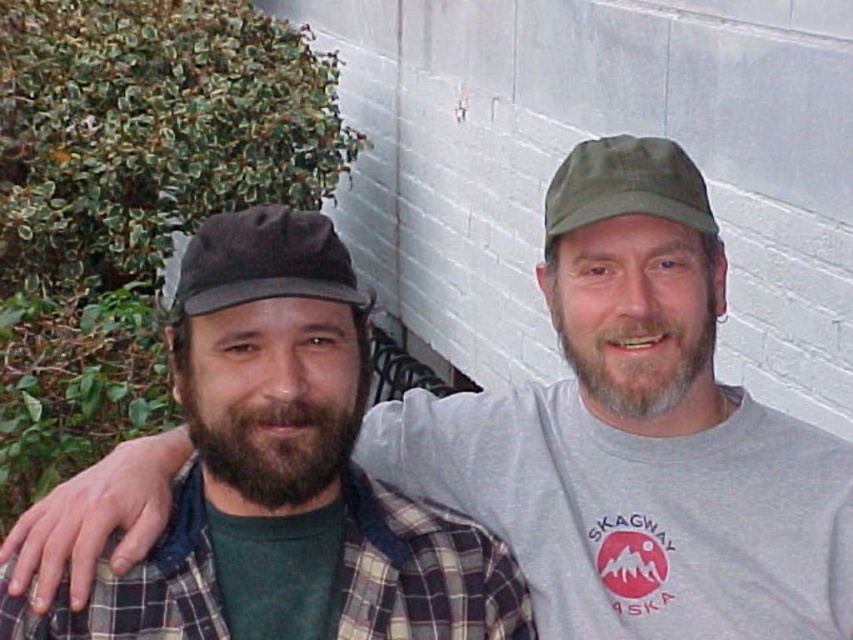
You are a photographer trying to capture a clear photo of both the dark brown fabric baseball cap at center and the green fabric cap at upper center. Based on their positions, which cap should you focus on first to ensure both are in frame?

The dark brown fabric baseball cap at center is positioned on the left side of green fabric cap at upper center, so you should focus on the dark brown fabric baseball cap at center first to ensure both are in frame.

You are a photographer trying to capture both the dark brown fabric baseball cap at center and the green fabric cap at upper center in a single photo. Which cap will appear larger in the photo?

The dark brown fabric baseball cap at center will appear larger in the photo because it is closer to the viewer than the green fabric cap at upper center.